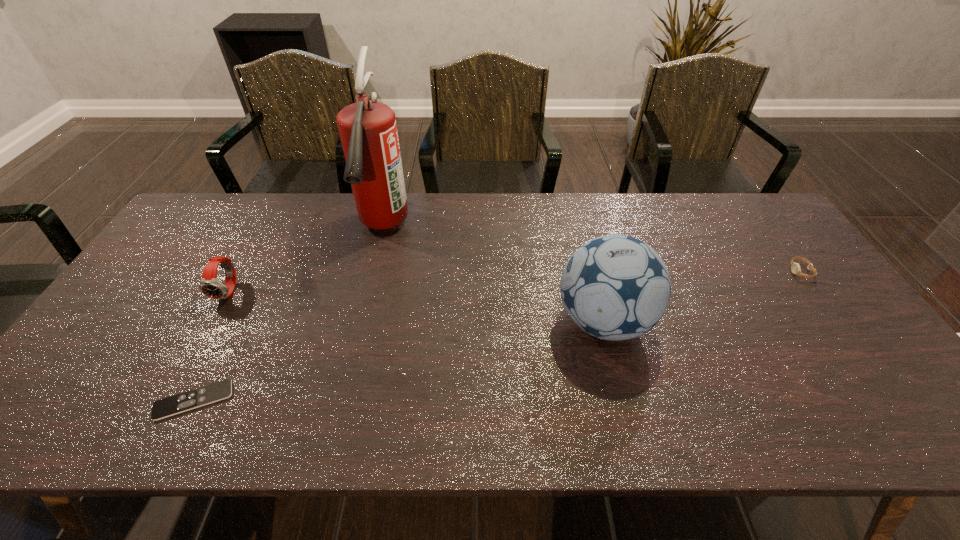
Identify the location of vacant space located 0.190m at the nozzle of the fire extinguisher. (360, 322).

Find the location of `free space located on the side with brand of the soccer ball`. free space located on the side with brand of the soccer ball is located at coordinates (486, 321).

Where is `vacant area situated 0.220m on the side with brand of the soccer ball`? This screenshot has height=540, width=960. vacant area situated 0.220m on the side with brand of the soccer ball is located at coordinates (470, 321).

Where is `blank space located on the side with brand of the soccer ball`? Image resolution: width=960 pixels, height=540 pixels. blank space located on the side with brand of the soccer ball is located at coordinates pos(420,321).

You are a GUI agent. You are given a task and a screenshot of the screen. Output one action in this format:
    pyautogui.click(x=<x>, y=<y>)
    Task: Click on the blank space located on the face of the taller watch
    The width and height of the screenshot is (960, 540).
    Given the screenshot: What is the action you would take?
    pyautogui.click(x=149, y=437)

Identify the location of vacant space situated 0.120m on the face of the right watch. tap(750, 272).

Where is `vacant space situated 0.260m on the face of the right watch`? Image resolution: width=960 pixels, height=540 pixels. vacant space situated 0.260m on the face of the right watch is located at coordinates (x=702, y=272).

I want to click on vacant space located on the face of the right watch, so click(x=671, y=272).

This screenshot has width=960, height=540. I want to click on free space located 0.260m on the right of the shortest object, so click(346, 400).

This screenshot has height=540, width=960. I want to click on object that is at the far edge, so click(x=368, y=131).